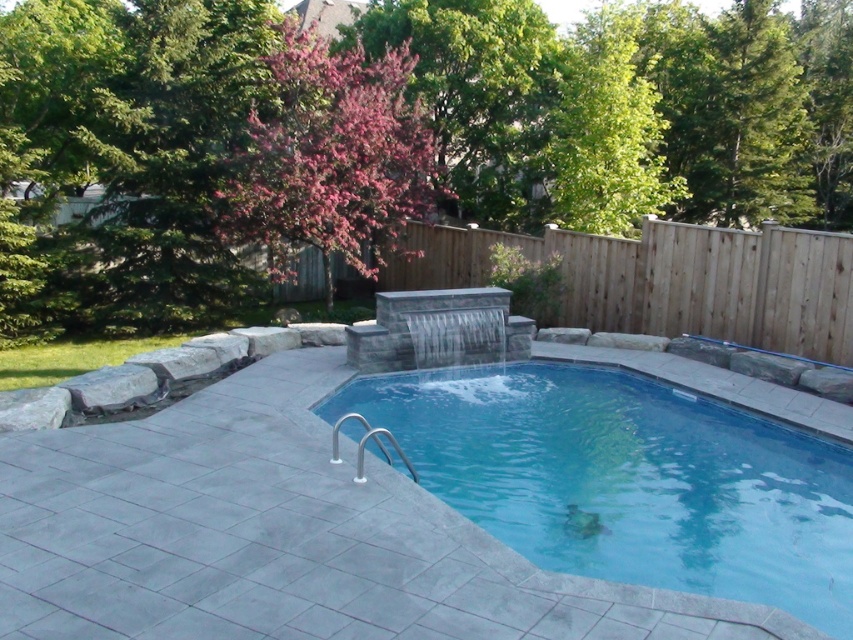
Between point (656, 390) and point (463, 269), which one is positioned in front?

Positioned in front is point (656, 390).

Is point (680, 529) behind point (764, 276)?

That is False.

This screenshot has width=853, height=640. What do you see at coordinates (628, 480) in the screenshot?
I see `blue smooth pool at center` at bounding box center [628, 480].

The image size is (853, 640). I want to click on blue smooth pool at center, so click(x=628, y=480).

Who is more forward, (699, 230) or (666, 330)?

Point (699, 230) is more forward.

Between pink flowering tree at upper center and wooden fence at upper center, which one is positioned higher?

pink flowering tree at upper center is above.

Is point (93, 250) positioned after point (767, 237)?

Yes, point (93, 250) is behind point (767, 237).

You are a GUI agent. You are given a task and a screenshot of the screen. Output one action in this format:
    pyautogui.click(x=<x>, y=<y>)
    Task: Click on the pink flowering tree at upper center
    
    Given the screenshot: What is the action you would take?
    pyautogui.click(x=636, y=160)

Is point (780, 317) in front of point (337, 131)?

That is True.

Between point (302, 284) and point (309, 240), which one is positioned behind?

The point (302, 284) is more distant.

At what (x,y) coordinates should I click in order to perform the action: click on wooden fence at upper center. Please return your answer as a coordinate pair (x, y). The image size is (853, 640). Looking at the image, I should click on (x=668, y=280).